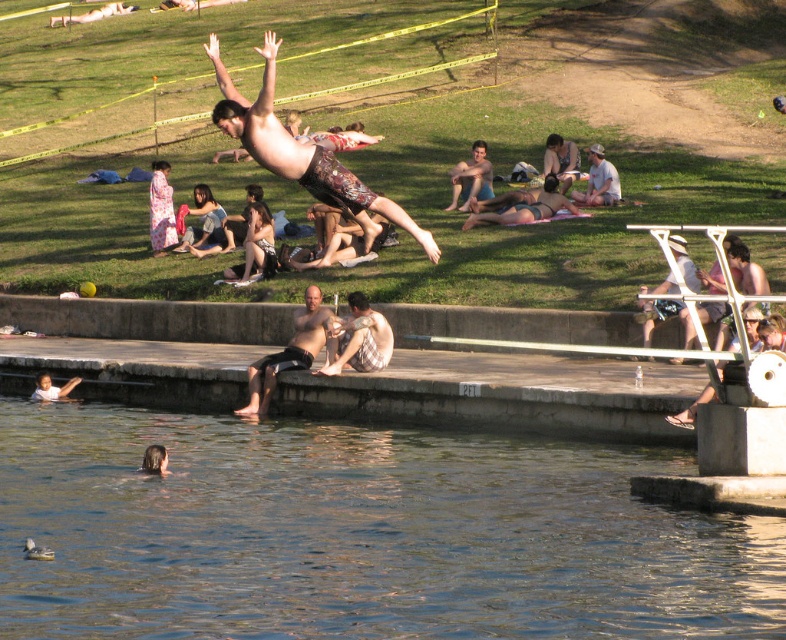
You are a photographer standing at the edge of the pool. You want to take a photo of the plaid fabric shirt at center and the smooth skin child at lower left. Which object should you focus on first to ensure both are in focus?

The plaid fabric shirt at center is closer to the viewer than the smooth skin child at lower left, so you should focus on the plaid fabric shirt at center first to ensure both are in focus.

You are a parent watching your child at the pool. You see the clear water at lower left and the smooth skin child at lower left. Which one is closer to you?

The clear water at lower left is closer to you because it is in front of the smooth skin child at lower left.